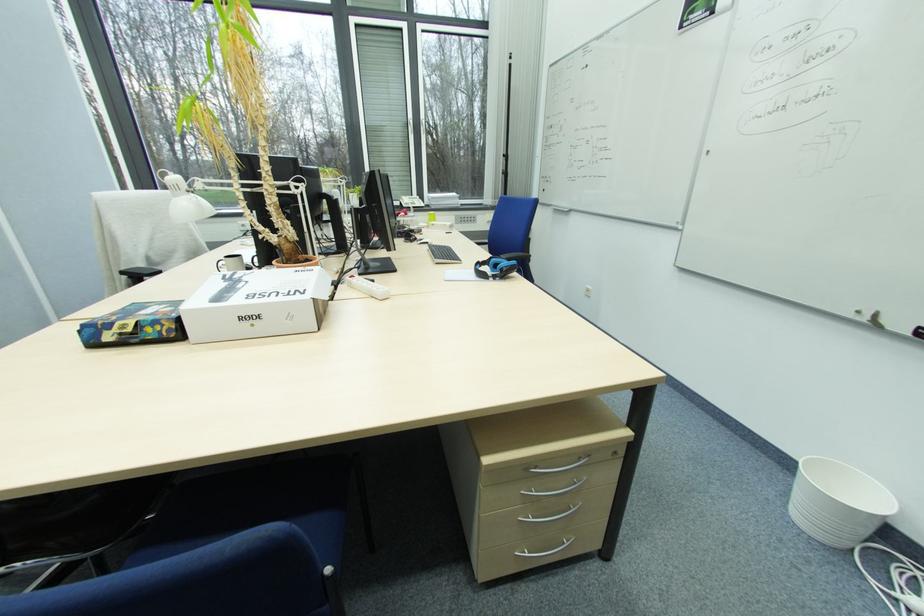
Where would you lift the white trash bin? Please return your answer as a coordinate pair (x, y).

(837, 501)